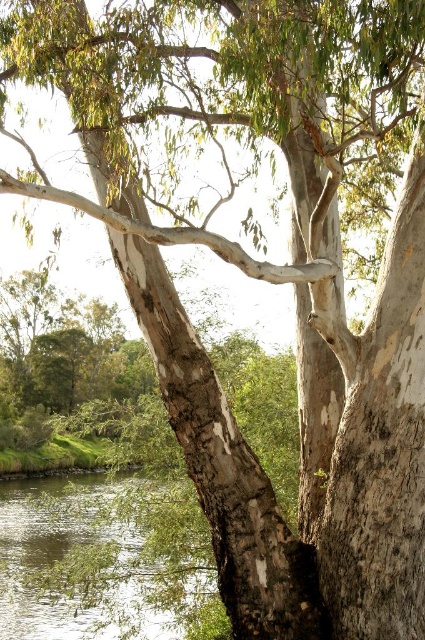
Is white rough bark tree trunk at center bigger than clear water at lower left?

No.

Does white rough bark tree trunk at center lie behind clear water at lower left?

No, it is not.

Is point (237, 472) behind point (110, 502)?

No, (237, 472) is in front of (110, 502).

Identify the location of white rough bark tree trunk at center. This screenshot has width=425, height=640. (221, 465).